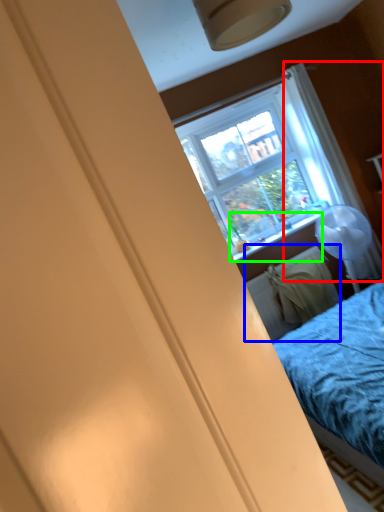
Question: Which object is positioned closest to curtain (highlighted by a red box)? Select from radiator (highlighted by a blue box) and window sill (highlighted by a green box).

Choices:
 (A) radiator
 (B) window sill

Answer: (B)